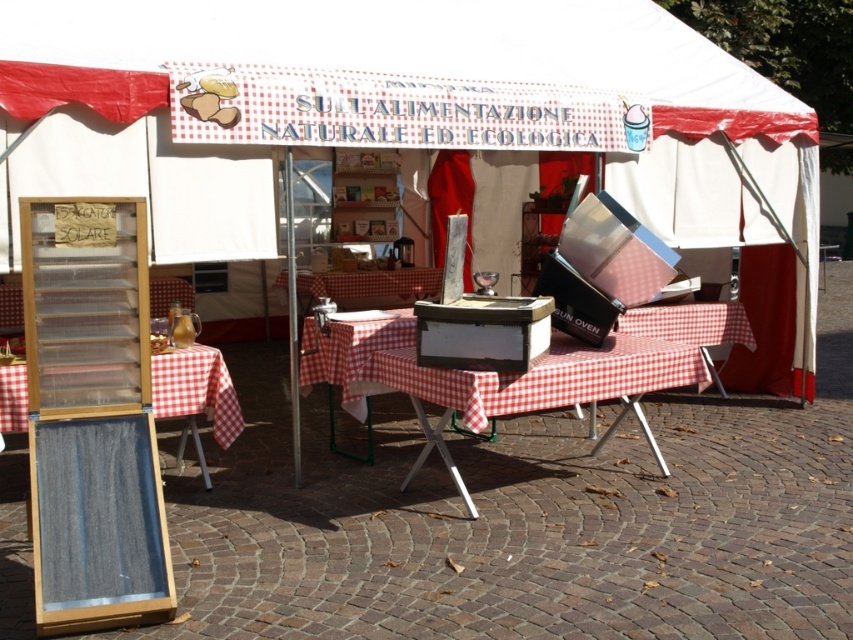
Question: Which of the following is the farthest from the observer?

Choices:
 (A) denim board at lower left
 (B) checkered fabric picnic table at center
 (C) wooden chair at lower left

Answer: (C)

Question: Does denim board at lower left appear on the right side of wooden chair at lower left?

Choices:
 (A) no
 (B) yes

Answer: (B)

Question: Which point is farther to the camera?

Choices:
 (A) (190, 292)
 (B) (196, 360)
 (C) (635, 403)

Answer: (A)

Question: Is checkered fabric picnic table at center in front of denim board at lower left?

Choices:
 (A) no
 (B) yes

Answer: (B)

Question: Can you confirm if denim board at lower left is wider than wooden chair at lower left?

Choices:
 (A) yes
 (B) no

Answer: (A)

Question: Which object is the farthest from the wooden chair at lower left?

Choices:
 (A) denim board at lower left
 (B) checkered fabric picnic table at center

Answer: (B)